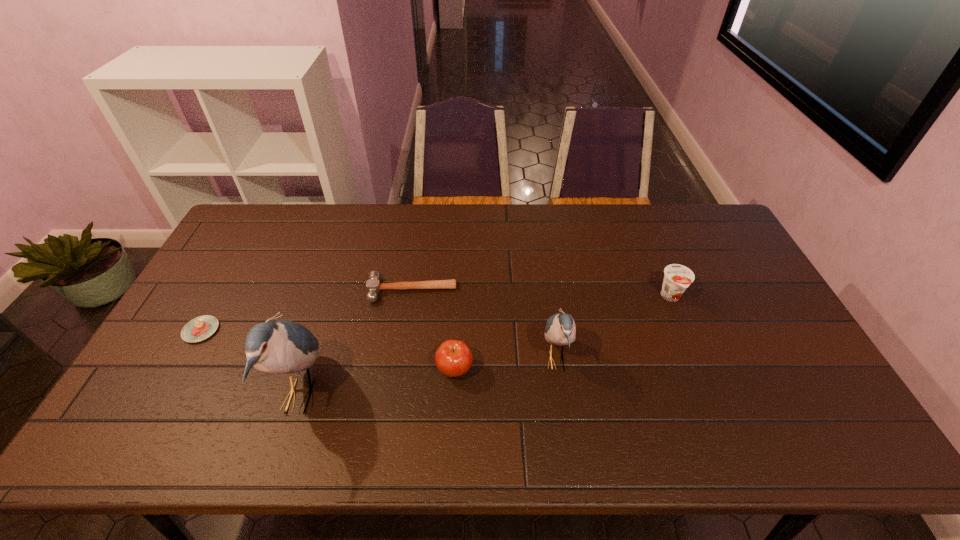
Find the location of a particular element. Image resolution: width=960 pixels, height=540 pixels. vacant space situated at the tip of the fifth shortest object's beak is located at coordinates (706, 360).

Where is `free space located 0.160m on the right of the rightmost object`? The image size is (960, 540). free space located 0.160m on the right of the rightmost object is located at coordinates (737, 297).

I want to click on vacant space located on the back of the pastry, so click(240, 261).

The width and height of the screenshot is (960, 540). What are the coordinates of `vacant space located on the right of the hammer` in the screenshot? It's located at (504, 291).

You are a GUI agent. You are given a task and a screenshot of the screen. Output one action in this format:
    pyautogui.click(x=<x>, y=<y>)
    Task: Click on the vacant space located on the left of the apple
    
    Given the screenshot: What is the action you would take?
    pyautogui.click(x=357, y=369)

You are a GUI agent. You are given a task and a screenshot of the screen. Output one action in this format:
    pyautogui.click(x=<x>, y=<y>)
    Task: Click on the apple present at the near edge
    The width and height of the screenshot is (960, 540).
    Given the screenshot: What is the action you would take?
    [453, 358]

In order to click on object present at the left edge in this screenshot , I will do `click(200, 328)`.

Where is `vacant space at the far edge of the desktop`? The width and height of the screenshot is (960, 540). vacant space at the far edge of the desktop is located at coordinates (368, 206).

Locate an element on the screen. vacant space at the near edge is located at coordinates (486, 412).

In the image, there is a desktop. Where is `vacant space at the left edge`? vacant space at the left edge is located at coordinates (161, 361).